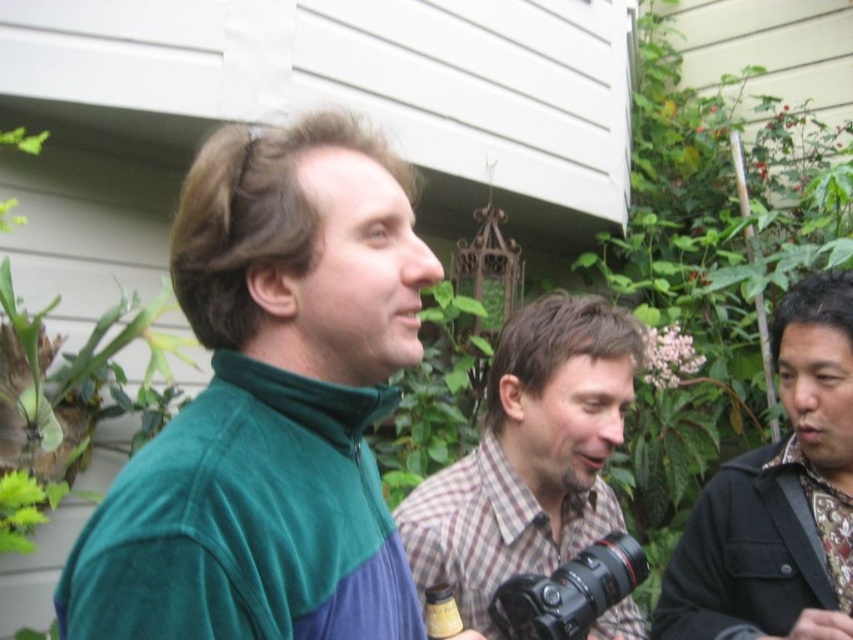
Between point (346, 147) and point (548, 605), which one is positioned in front?

Point (346, 147) is more forward.

Is green fleece jacket at center above black plastic camera at center?

Yes.

Between point (140, 460) and point (544, 621), which one is positioned behind?

The point (544, 621) is more distant.

Where is `green fleece jacket at center`? The image size is (853, 640). green fleece jacket at center is located at coordinates point(270,406).

Is green fleece jacket at center shorter than plaid fabric shirt at center?

Correct, green fleece jacket at center is not as tall as plaid fabric shirt at center.

The width and height of the screenshot is (853, 640). Identify the location of green fleece jacket at center. (270, 406).

Is plaid fabric shirt at center further to camera compared to black textured shirt at right?

No, plaid fabric shirt at center is in front of black textured shirt at right.

Is plaid fabric shirt at center in front of black textured shirt at right?

Yes, it is in front of black textured shirt at right.

What do you see at coordinates (529, 456) in the screenshot?
I see `plaid fabric shirt at center` at bounding box center [529, 456].

Locate an element on the screen. The height and width of the screenshot is (640, 853). plaid fabric shirt at center is located at coordinates 529,456.